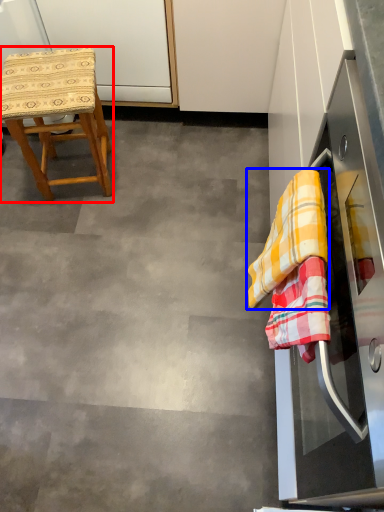
Question: Among these objects, which one is nearest to the camera, stool (highlighted by a red box) or clothe (highlighted by a blue box)?

Choices:
 (A) stool
 (B) clothe

Answer: (B)